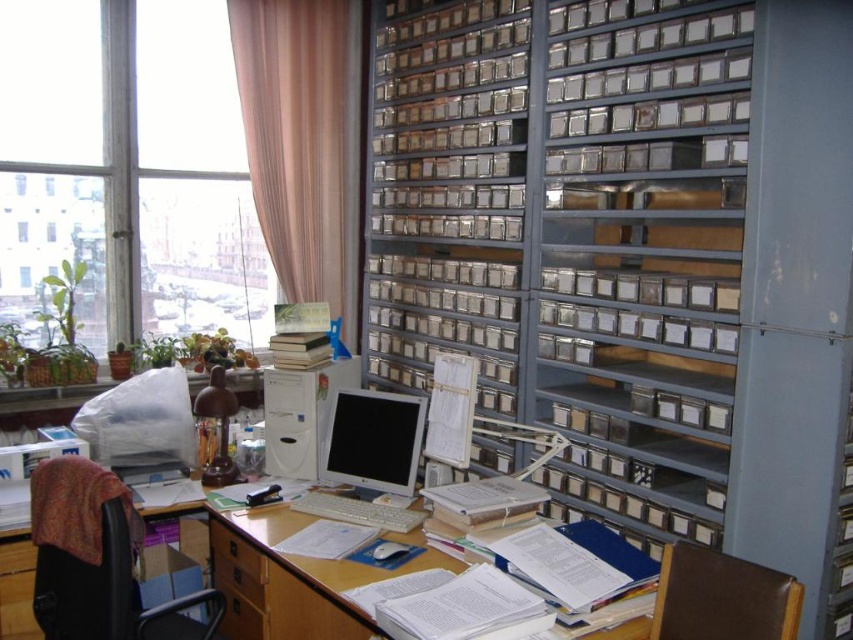
Question: Which of these objects is positioned closest to the metallic gray bookshelf at upper right?

Choices:
 (A) velvet-like brown chair at lower left
 (B) transparent plastic window at upper left
 (C) white plastic desktop computer at center
 (D) hardcover books at center

Answer: (C)

Question: Which of these objects is positioned closest to the white paper book at center?

Choices:
 (A) hardcover books at center
 (B) metallic gray bookshelf at upper right

Answer: (B)

Question: Observing the image, what is the correct spatial positioning of white plastic desktop computer at center in reference to brown wood drawer at lower left?

Choices:
 (A) above
 (B) below

Answer: (A)

Question: Can you confirm if transparent glass window at upper left is positioned to the right of brown leather chair at lower right?

Choices:
 (A) yes
 (B) no

Answer: (B)

Question: Can you confirm if hardcover books at center is wider than brown wood drawer at lower left?

Choices:
 (A) yes
 (B) no

Answer: (B)

Question: Among these points, which one is nearest to the camera?

Choices:
 (A) coord(469,493)
 (B) coord(299,332)

Answer: (A)